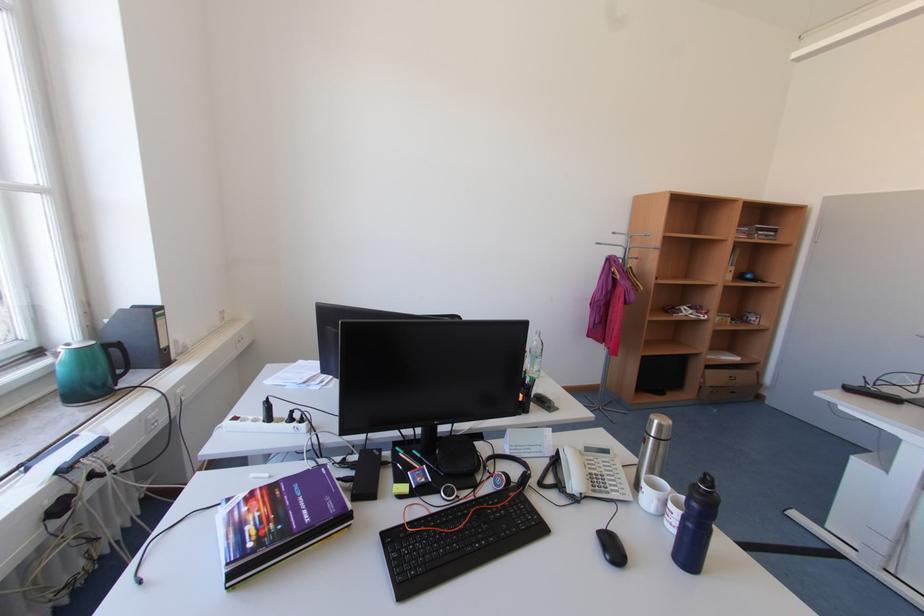
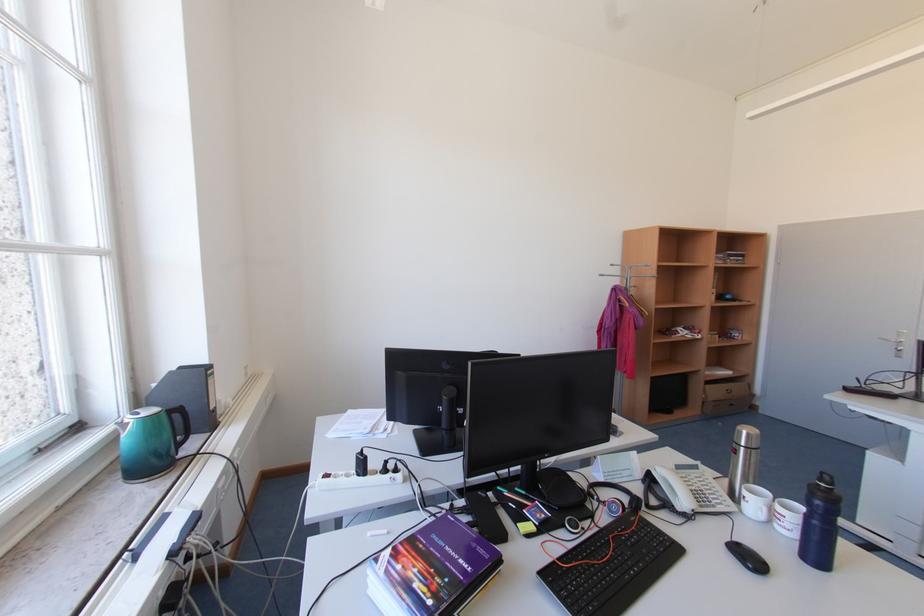
Where in the second image is the point corresponding to point (622, 233) from the first image?

(619, 265)